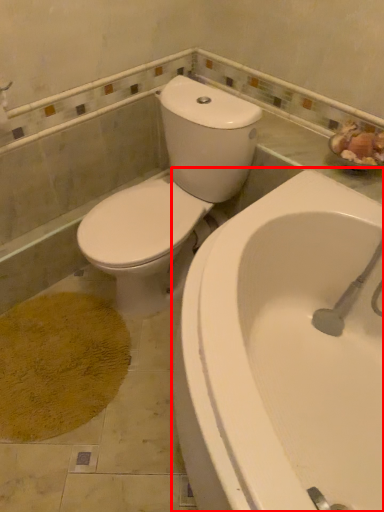
Question: From the image's perspective, what is the correct spatial relationship of bathtub (annotated by the red box) in relation to toilet?

Choices:
 (A) above
 (B) below

Answer: (B)